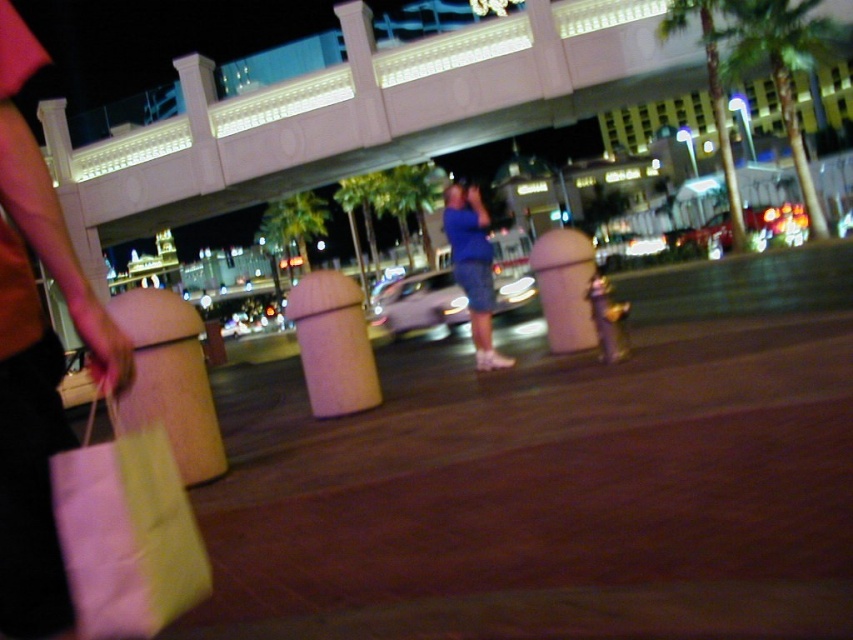
Does pink matte trash can at center appear on the left side of blue fabric dress at center?

Correct, you'll find pink matte trash can at center to the left of blue fabric dress at center.

Is point (352, 362) in front of point (448, 225)?

Yes.

Which is in front, point (341, 392) or point (469, 291)?

Point (341, 392) is in front.

This screenshot has width=853, height=640. I want to click on pink matte trash can at center, so click(x=334, y=342).

Is point (692, 492) farther from camera compared to point (561, 317)?

No.

Does brown smooth pavement at center appear under matte plastic trash can at center?

Yes, brown smooth pavement at center is below matte plastic trash can at center.

Locate an element on the screen. brown smooth pavement at center is located at coordinates (550, 500).

This screenshot has width=853, height=640. I want to click on brown smooth pavement at center, so click(550, 500).

At what (x,y) coordinates should I click in order to perform the action: click on brown smooth pavement at center. Please return your answer as a coordinate pair (x, y). The width and height of the screenshot is (853, 640). Looking at the image, I should click on (550, 500).

Is point (486, 436) closer to viewer compared to point (334, 401)?

Yes, it is in front of point (334, 401).

Where is `brown smooth pavement at center`? The image size is (853, 640). brown smooth pavement at center is located at coordinates (550, 500).